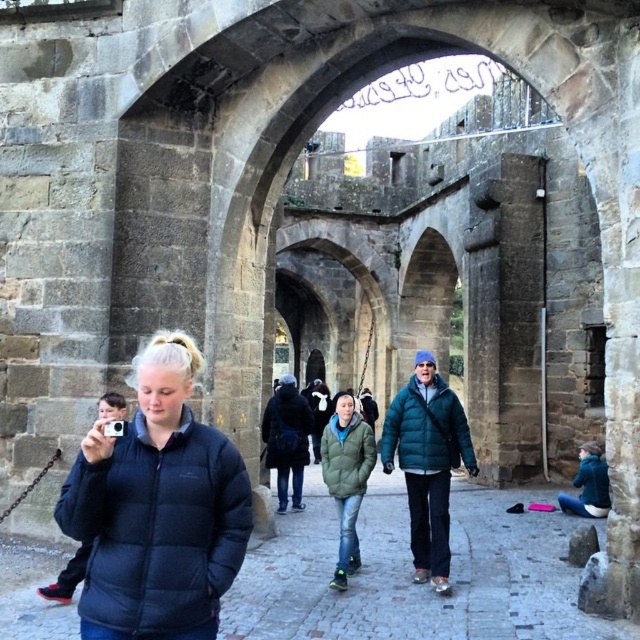
You are a photographer trying to capture both the green matte jacket at center and the teal fleece jacket at lower right in the same frame. Which jacket should you adjust your focus to ensure the one closer to you is sharp?

The green matte jacket at center is in front of the teal fleece jacket at lower right, so you should adjust your focus on the green matte jacket at center to ensure it is sharp as it is closer to you.

You are a photographer trying to capture both the matte black jacket at left and the teal fleece jacket at lower right in the same frame. Based on their positions, which jacket should you focus on first to ensure both are in the shot?

The matte black jacket at left is located above the teal fleece jacket at lower right, so you should focus on the teal fleece jacket at lower right first to ensure both are in the shot.

You are a photographer trying to capture a photo of the historic stone archway. You notice two jackets in the scene, the teal puffer jacket at center and the green matte jacket at center. Which jacket is positioned higher in the frame?

The teal puffer jacket at center is located above the green matte jacket at center, so it is positioned higher in the frame.